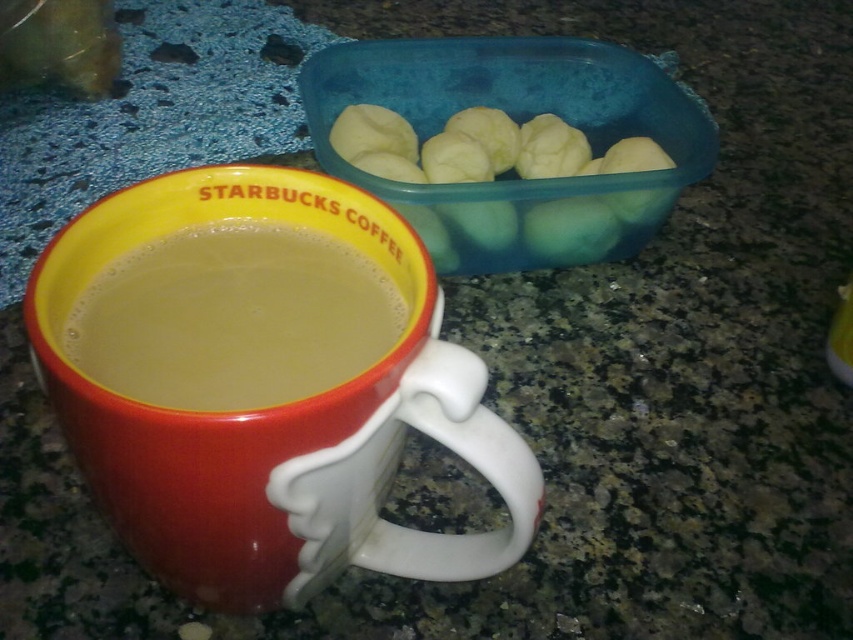
In the scene shown: You are a barista preparing drinks and see the matte ceramic mug at center and the smooth white dough balls at upper right. Which object is taller?

The matte ceramic mug at center is taller than the smooth white dough balls at upper right.

You are a barista arranging items on a counter. You have two matte ceramic mugs to place. The matte ceramic mug at center and the matte ceramic mug at lower left. The customer wants the mugs to be at least 10 centimeters apart. Based on the image, can you confirm if the current placement meets the customer requirement?

The distance between the matte ceramic mug at center and the matte ceramic mug at lower left is 7.16 centimeters, which is less than the required 10 centimeters. Therefore, the current placement does not meet the customer requirement.